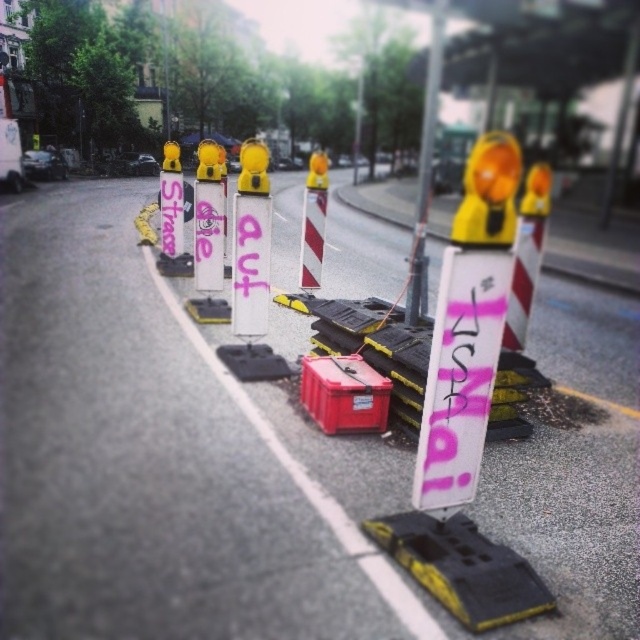
Question: Is pink matte sign at center bigger than dark gray metallic car at center?

Choices:
 (A) yes
 (B) no

Answer: (A)

Question: Which object appears farthest from the camera in this image?

Choices:
 (A) pink matte sign at center
 (B) white plastic pole at center
 (C) metallic silver car at left
 (D) dark gray metallic car at center

Answer: (D)

Question: Does white plastic pole at center appear on the right side of metallic silver car at left?

Choices:
 (A) yes
 (B) no

Answer: (A)

Question: Which is nearer to the pink matte sign at center?

Choices:
 (A) metallic silver car at left
 (B) white plastic pole at center
 (C) dark gray metallic car at center

Answer: (B)

Question: Can you confirm if pink matte sign at center is thinner than metallic silver car at left?

Choices:
 (A) no
 (B) yes

Answer: (B)

Question: Which point is closer to the camera taking this photo?

Choices:
 (A) (445, 506)
 (B) (440, 54)
 (C) (28, 154)
 (D) (134, 172)

Answer: (A)